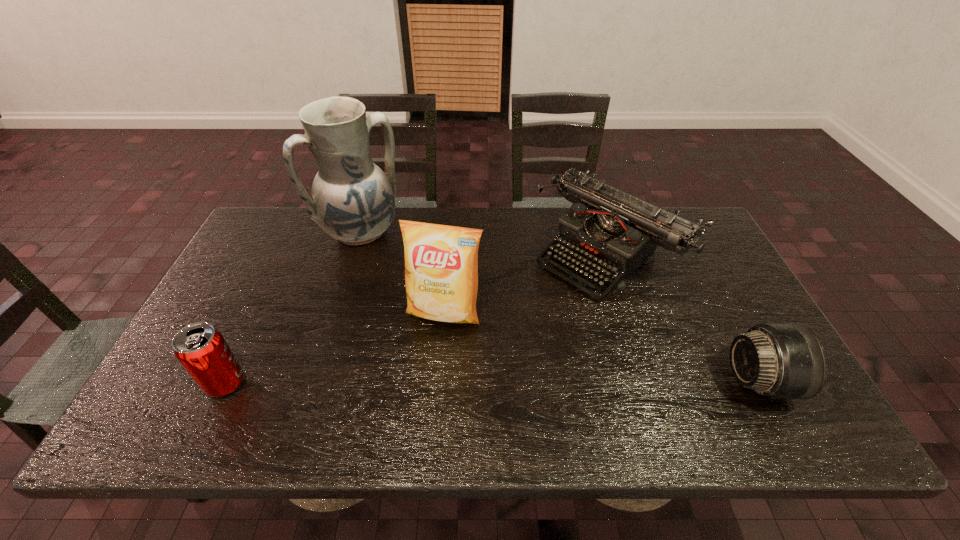
Find the location of a particular element. object present at the left edge is located at coordinates (201, 349).

Locate an element on the screen. Image resolution: width=960 pixels, height=540 pixels. telephoto lens that is at the right edge is located at coordinates (776, 360).

This screenshot has height=540, width=960. I want to click on typewriter located at the right edge, so click(614, 232).

Image resolution: width=960 pixels, height=540 pixels. Find the location of `object that is positioned at the near left corner`. object that is positioned at the near left corner is located at coordinates (201, 349).

Find the location of `object that is at the far right corner`. object that is at the far right corner is located at coordinates (614, 232).

The image size is (960, 540). Identify the location of object situated at the near right corner. (776, 360).

In the image, there is a desktop. At what (x,y) coordinates should I click in order to perform the action: click on vacant region at the far edge. Please return your answer as a coordinate pair (x, y). Looking at the image, I should click on (529, 211).

At what (x,y) coordinates should I click in order to perform the action: click on vacant area at the near edge of the desktop. Please return your answer as a coordinate pair (x, y). Image resolution: width=960 pixels, height=540 pixels. Looking at the image, I should click on (492, 387).

Locate an element on the screen. This screenshot has height=540, width=960. vacant area at the left edge is located at coordinates (237, 320).

At what (x,y) coordinates should I click in order to perform the action: click on vacant space at the right edge of the desktop. Please return your answer as a coordinate pair (x, y). This screenshot has height=540, width=960. Looking at the image, I should click on (708, 298).